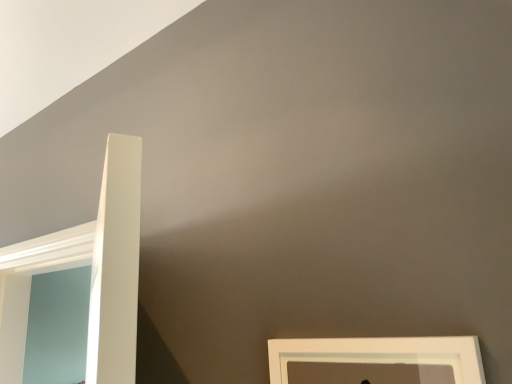
This screenshot has height=384, width=512. What do you see at coordinates (381, 353) in the screenshot?
I see `white matte picture frame at lower right` at bounding box center [381, 353].

Measure the distance between point (x=323, y=353) and camera.

They are 26.22 inches apart.

Locate an element on the screen. The width and height of the screenshot is (512, 384). white matte picture frame at lower right is located at coordinates (381, 353).

You are a GUI agent. You are given a task and a screenshot of the screen. Output one action in this format:
    pyautogui.click(x=<x>, y=<y>)
    Task: Click on the white matte picture frame at lower right
    The height and width of the screenshot is (384, 512).
    Given the screenshot: What is the action you would take?
    pyautogui.click(x=381, y=353)